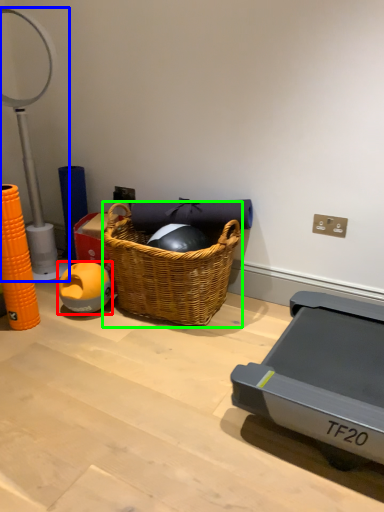
Question: Considering the real-world distances, which object is farthest from ball (highlighted by a red box)? table lamp (highlighted by a blue box) or picnic basket (highlighted by a green box)?

Choices:
 (A) table lamp
 (B) picnic basket

Answer: (A)